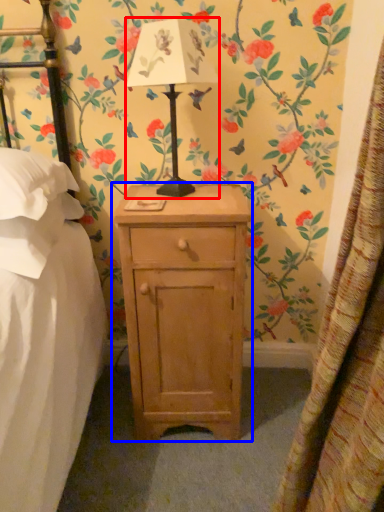
Question: Which object appears closest to the camera in this image, table lamp (highlighted by a red box) or nightstand (highlighted by a blue box)?

Choices:
 (A) table lamp
 (B) nightstand

Answer: (A)